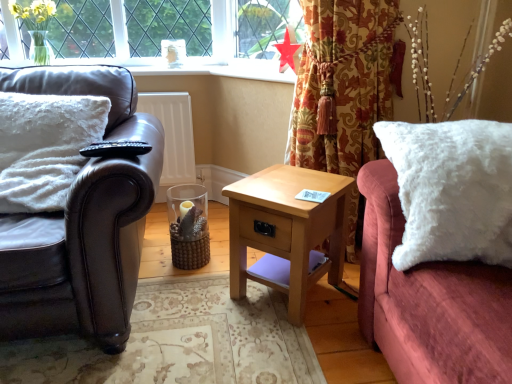
Question: Is leather couch at left far from light wood/texture nightstand at center?

Choices:
 (A) yes
 (B) no

Answer: (B)

Question: Is leather couch at left wider than light wood/texture nightstand at center?

Choices:
 (A) no
 (B) yes

Answer: (B)

Question: Considering the relative sizes of leather couch at left and light wood/texture nightstand at center in the image provided, is leather couch at left thinner than light wood/texture nightstand at center?

Choices:
 (A) no
 (B) yes

Answer: (A)

Question: Is leather couch at left further to the viewer compared to light wood/texture nightstand at center?

Choices:
 (A) no
 (B) yes

Answer: (A)

Question: Is leather couch at left facing towards light wood/texture nightstand at center?

Choices:
 (A) yes
 (B) no

Answer: (B)

Question: Is point (232, 253) positioned closer to the camera than point (116, 122)?

Choices:
 (A) closer
 (B) farther

Answer: (A)

Question: In terms of width, does light wood/texture nightstand at center look wider or thinner when compared to leather couch at left?

Choices:
 (A) wide
 (B) thin

Answer: (B)

Question: From a real-world perspective, relative to leather couch at left, is light wood/texture nightstand at center vertically above or below?

Choices:
 (A) below
 (B) above

Answer: (A)

Question: Considering the positions of light wood/texture nightstand at center and leather couch at left in the image, is light wood/texture nightstand at center taller or shorter than leather couch at left?

Choices:
 (A) short
 (B) tall

Answer: (A)

Question: From a real-world perspective, is red paper star at upper center above or below white fluffy pillow at left?

Choices:
 (A) above
 (B) below

Answer: (A)

Question: Based on their positions, is red paper star at upper center located to the left or right of white fluffy pillow at left?

Choices:
 (A) left
 (B) right

Answer: (B)

Question: From the image's perspective, relative to white fluffy pillow at left, is red paper star at upper center above or below?

Choices:
 (A) below
 (B) above

Answer: (B)

Question: In terms of height, does red paper star at upper center look taller or shorter compared to white fluffy pillow at left?

Choices:
 (A) tall
 (B) short

Answer: (B)

Question: Is light wood/texture nightstand at center to the left or to the right of white fluffy pillow at right in the image?

Choices:
 (A) right
 (B) left

Answer: (B)

Question: Is light wood/texture nightstand at center wider or thinner than white fluffy pillow at right?

Choices:
 (A) wide
 (B) thin

Answer: (B)